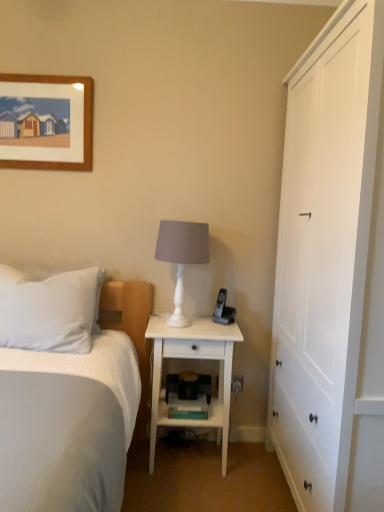
Locate an element on the screen. This screenshot has height=512, width=384. vacant region to the left of black plastic phone at right is located at coordinates (195, 323).